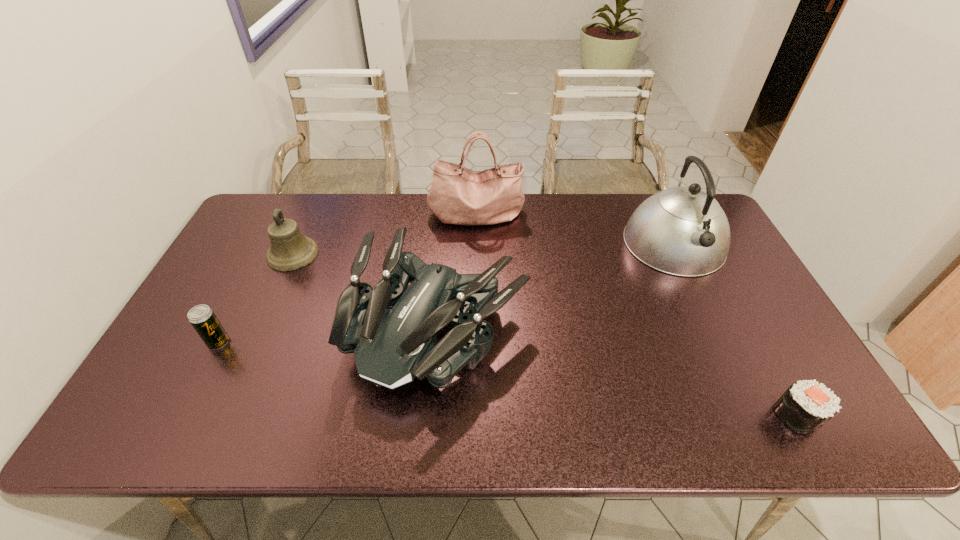
Image resolution: width=960 pixels, height=540 pixels. I want to click on object located at the far right corner, so click(683, 231).

This screenshot has width=960, height=540. I want to click on object that is at the near right corner, so click(806, 405).

In order to click on vacant space at the far edge of the desktop in this screenshot , I will do `click(612, 210)`.

Image resolution: width=960 pixels, height=540 pixels. In order to click on vacant space at the near edge of the desktop in this screenshot , I will do `click(361, 438)`.

Identify the location of free location at the right edge of the desktop. Image resolution: width=960 pixels, height=540 pixels. (732, 355).

Where is `empty space between the sushi and the bell`? empty space between the sushi and the bell is located at coordinates (545, 335).

This screenshot has height=540, width=960. What are the coordinates of `empty location between the shortest object and the kettle` in the screenshot? It's located at tap(736, 330).

Image resolution: width=960 pixels, height=540 pixels. What are the coordinates of `free space between the handbag and the bell` in the screenshot? It's located at (385, 234).

I want to click on unoccupied area between the beer can and the bell, so click(255, 298).

The width and height of the screenshot is (960, 540). In order to click on vacant area between the handbag and the fifth tallest object in this screenshot , I will do `click(348, 279)`.